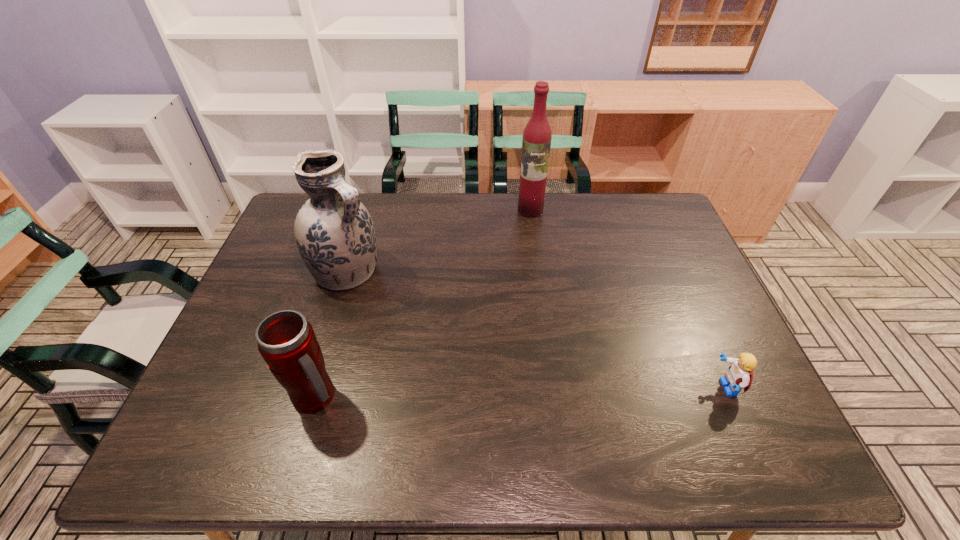
Find the location of `free space that satisfies the following two spatial constraints: 1. on the front side of the vase; 2. on the front-facing side of the shortest object`. free space that satisfies the following two spatial constraints: 1. on the front side of the vase; 2. on the front-facing side of the shortest object is located at coordinates (310, 388).

Find the location of a particular element. The width and height of the screenshot is (960, 540). vacant space that satisfies the following two spatial constraints: 1. on the front side of the farthest object; 2. on the front-facing side of the rightmost object is located at coordinates (554, 388).

Locate an element on the screen. Image resolution: width=960 pixels, height=540 pixels. vacant area that satisfies the following two spatial constraints: 1. on the front side of the farthest object; 2. on the front-facing side of the rightmost object is located at coordinates (554, 388).

The height and width of the screenshot is (540, 960). Identify the location of vacant space that satisfies the following two spatial constraints: 1. on the front side of the third shortest object; 2. on the front-facing side of the shortest object. (310, 388).